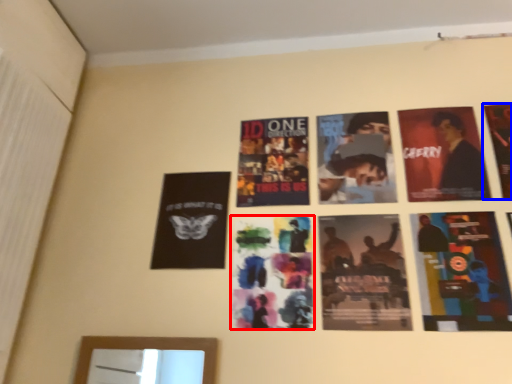
Question: Among these objects, which one is nearest to the camera, poster (highlighted by a red box) or poster (highlighted by a blue box)?

Choices:
 (A) poster
 (B) poster

Answer: (A)